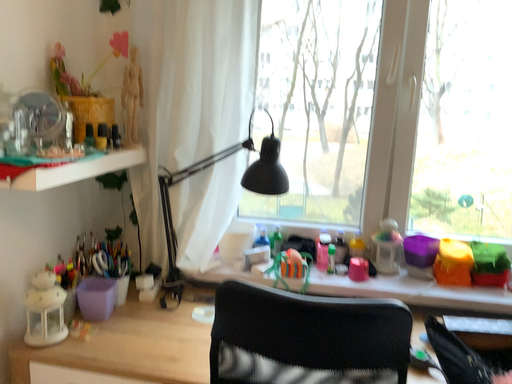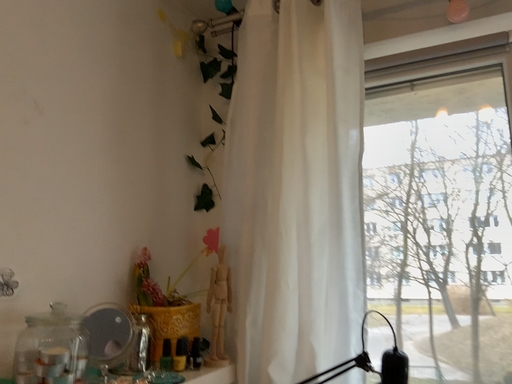
Question: How did the camera likely rotate when shooting the video?

Choices:
 (A) rotated upward
 (B) rotated downward

Answer: (A)